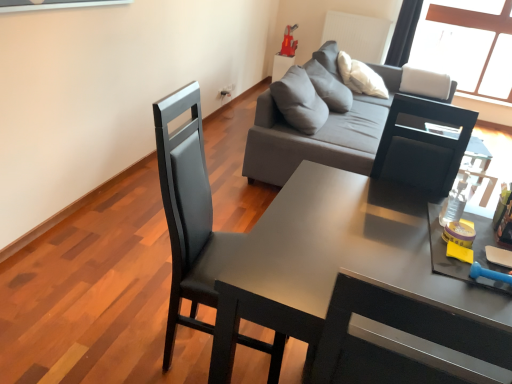
Question: From a real-world perspective, is gray fabric side table at upper center over matte black chair at center-left?

Choices:
 (A) no
 (B) yes

Answer: (A)

Question: Does gray fabric side table at upper center have a smaller size compared to matte black chair at center-left?

Choices:
 (A) yes
 (B) no

Answer: (A)

Question: Could you tell me if gray fabric side table at upper center is turned towards matte black chair at center-left?

Choices:
 (A) yes
 (B) no

Answer: (B)

Question: Would you say gray fabric side table at upper center is a long distance from matte black chair at center-left?

Choices:
 (A) yes
 (B) no

Answer: (A)

Question: Is gray fabric side table at upper center thinner than matte black chair at center-left?

Choices:
 (A) yes
 (B) no

Answer: (A)

Question: Looking at the image, does gray fabric couch at upper center seem bigger or smaller compared to gray fabric side table at upper center?

Choices:
 (A) small
 (B) big

Answer: (B)

Question: Based on their positions, is gray fabric couch at upper center located to the left or right of gray fabric side table at upper center?

Choices:
 (A) right
 (B) left

Answer: (A)

Question: Considering their positions, is gray fabric couch at upper center located in front of or behind gray fabric side table at upper center?

Choices:
 (A) behind
 (B) front

Answer: (B)

Question: From a real-world perspective, relative to gray fabric side table at upper center, is gray fabric couch at upper center vertically above or below?

Choices:
 (A) above
 (B) below

Answer: (A)

Question: Would you say gray fabric side table at upper center is to the left or to the right of matte black chair at center-left in the picture?

Choices:
 (A) right
 (B) left

Answer: (A)

Question: Is gray fabric side table at upper center in front of or behind matte black chair at center-left in the image?

Choices:
 (A) behind
 (B) front

Answer: (A)

Question: In terms of width, does gray fabric side table at upper center look wider or thinner when compared to matte black chair at center-left?

Choices:
 (A) thin
 (B) wide

Answer: (A)

Question: From a real-world perspective, relative to matte black chair at center-left, is gray fabric side table at upper center vertically above or below?

Choices:
 (A) below
 (B) above

Answer: (A)

Question: Is matte black desk at center taller or shorter than gray fabric couch at upper center?

Choices:
 (A) tall
 (B) short

Answer: (B)

Question: From a real-world perspective, relative to gray fabric couch at upper center, is matte black desk at center vertically above or below?

Choices:
 (A) below
 (B) above

Answer: (A)